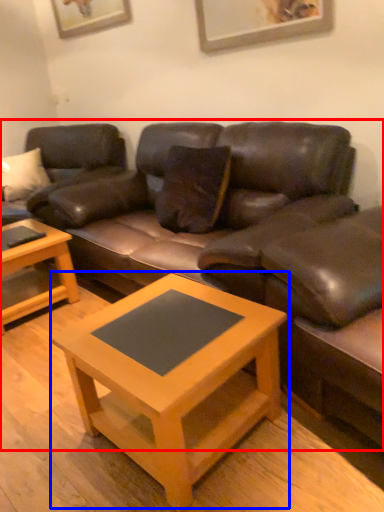
Question: Which point is closer to the camera, studio couch (highlighted by a red box) or coffee table (highlighted by a blue box)?

Choices:
 (A) studio couch
 (B) coffee table

Answer: (B)